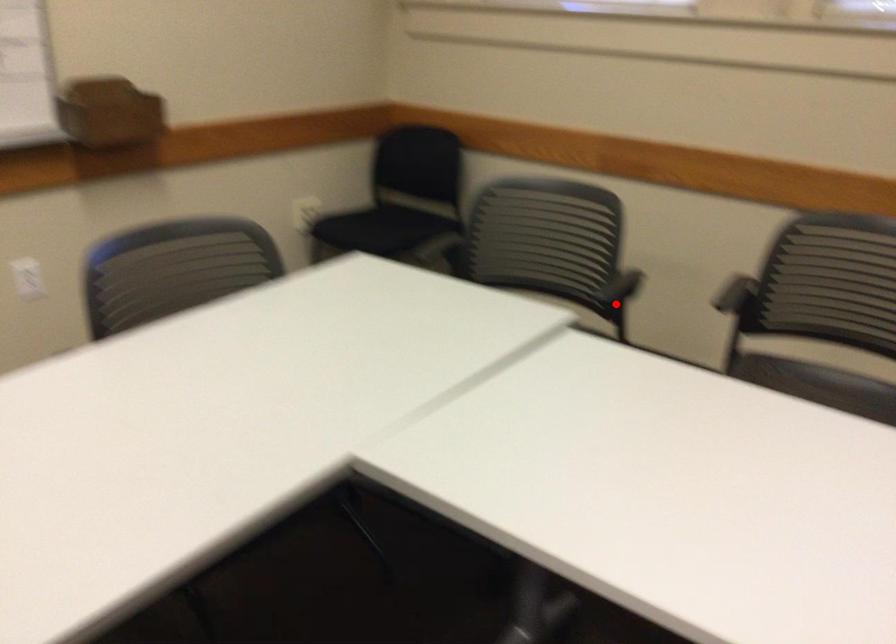
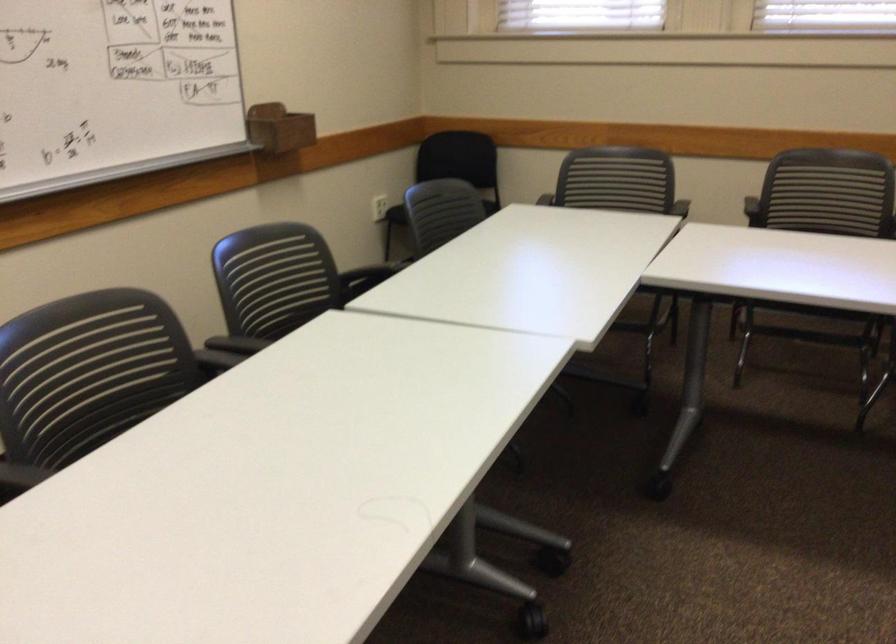
The point at the highlighted location is marked in the first image. Where is the corresponding point in the second image?

(678, 212)